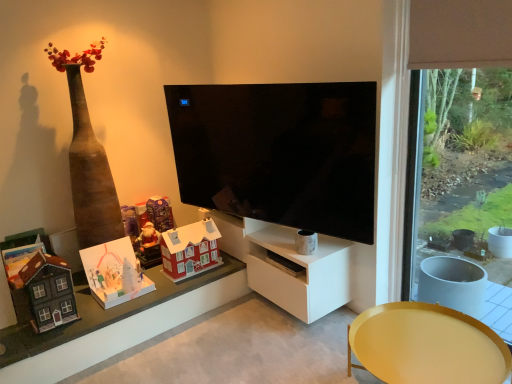
The height and width of the screenshot is (384, 512). I want to click on vacant area that is situated to the right of wooden house at lower left, the 1th toy when ordered from front to back, so click(x=91, y=314).